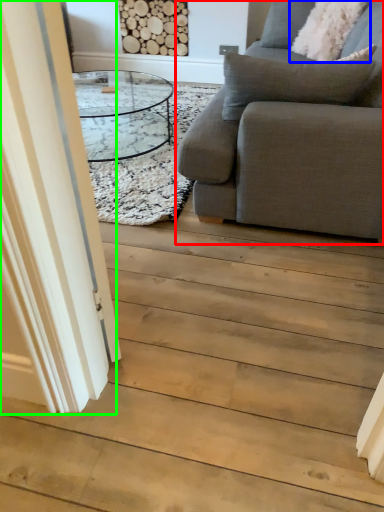
Question: Estimate the real-world distances between objects in this image. Which object is closer to studio couch (highlighted by a red box), pillow (highlighted by a blue box) or glass door (highlighted by a green box)?

Choices:
 (A) pillow
 (B) glass door

Answer: (B)